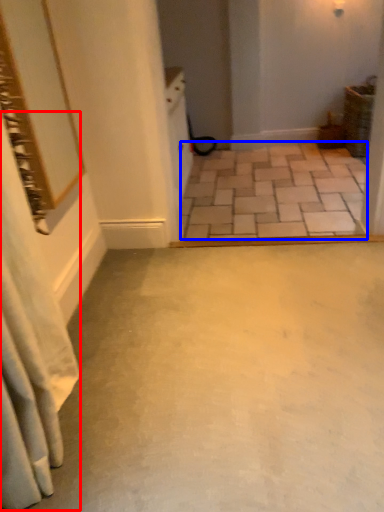
Question: Which object appears farthest to the camera in this image, shower curtain (highlighted by a red box) or concrete (highlighted by a blue box)?

Choices:
 (A) shower curtain
 (B) concrete

Answer: (B)